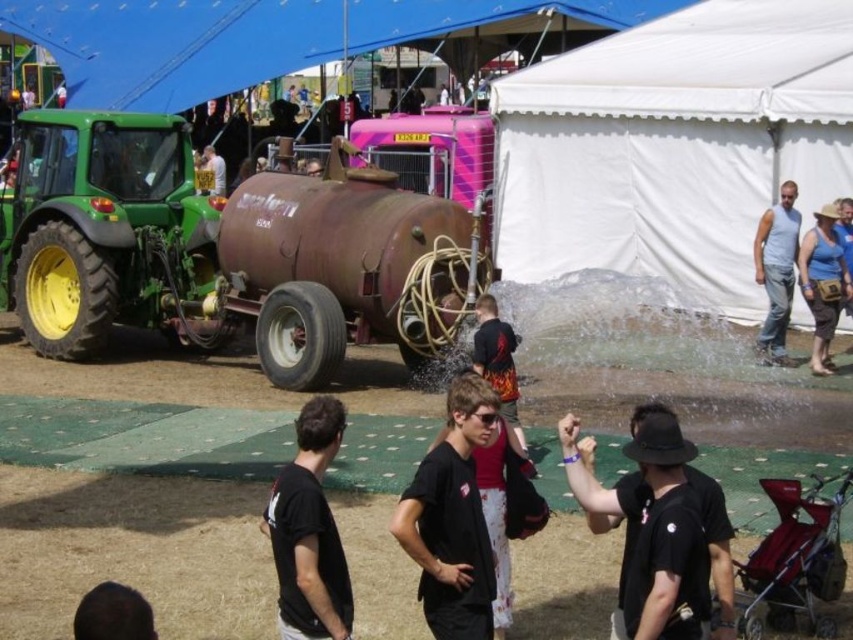
You are a festival attendee standing at the entrance of the fairground. You see a white fabric tent at center and a gray cotton tank top at right. Which object is closer to the ground?

The white fabric tent at center is closer to the ground because it is positioned below the gray cotton tank top at right.

You are a festival attendee who wants to take shelter under the white fabric tent at center. However, you notice the gray cotton tank top at right nearby. Which object is taller, and would the tent provide enough headroom for someone wearing the tank top?

The gray cotton tank top at right is taller than the white fabric tent at center. Therefore, the tent might not provide enough headroom for someone wearing the tank top.